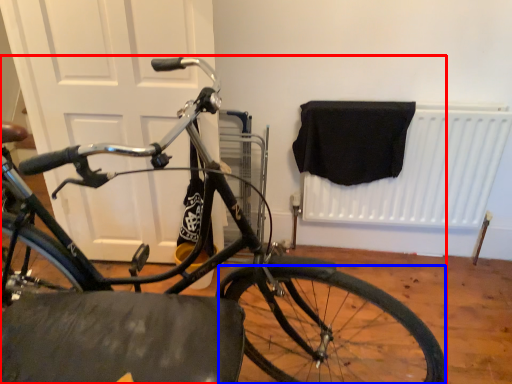
Question: Which point is closer to the camera, bicycle (highlighted by a red box) or bicycle wheel (highlighted by a blue box)?

Choices:
 (A) bicycle
 (B) bicycle wheel

Answer: (A)